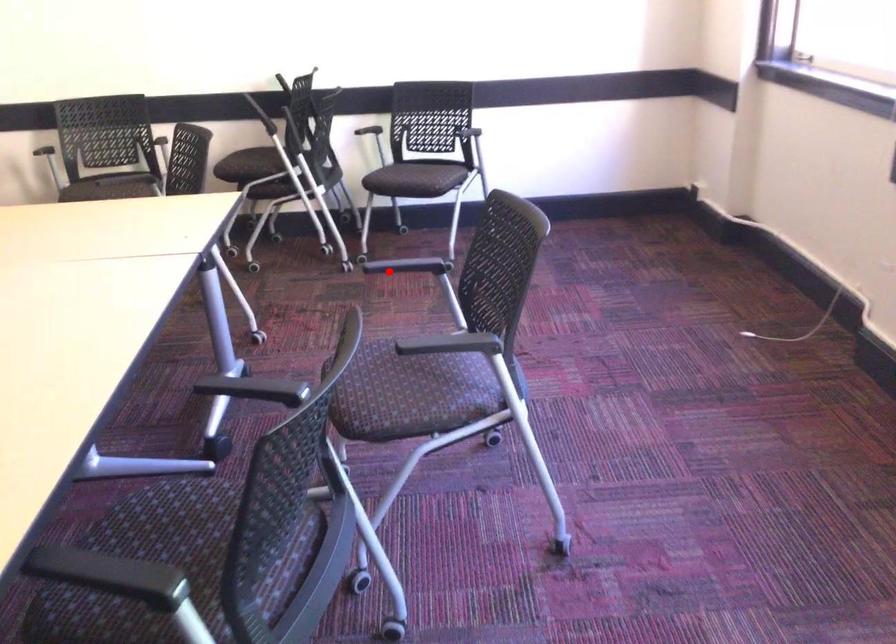
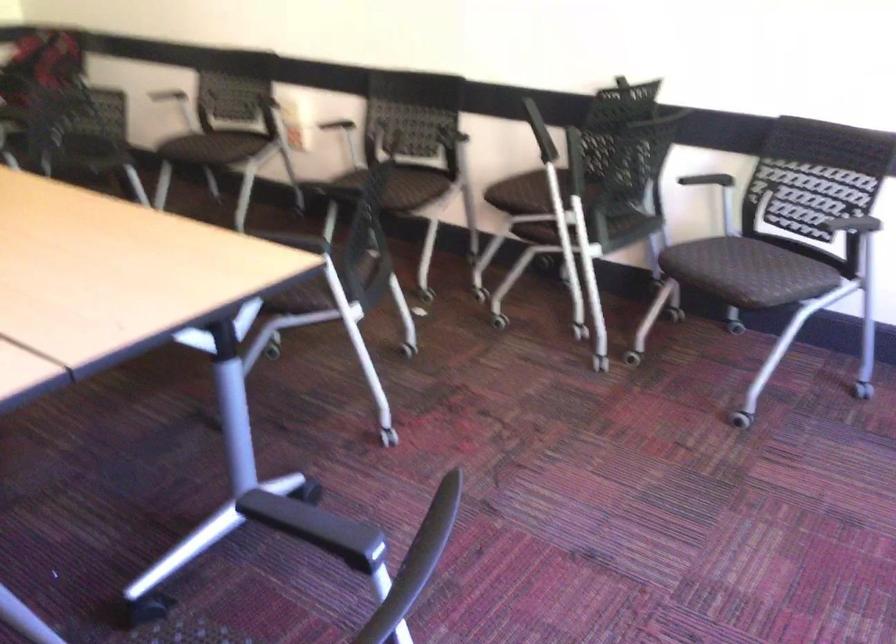
Find the pixel in the second image that matches the highlighted location in the first image.

(294, 518)